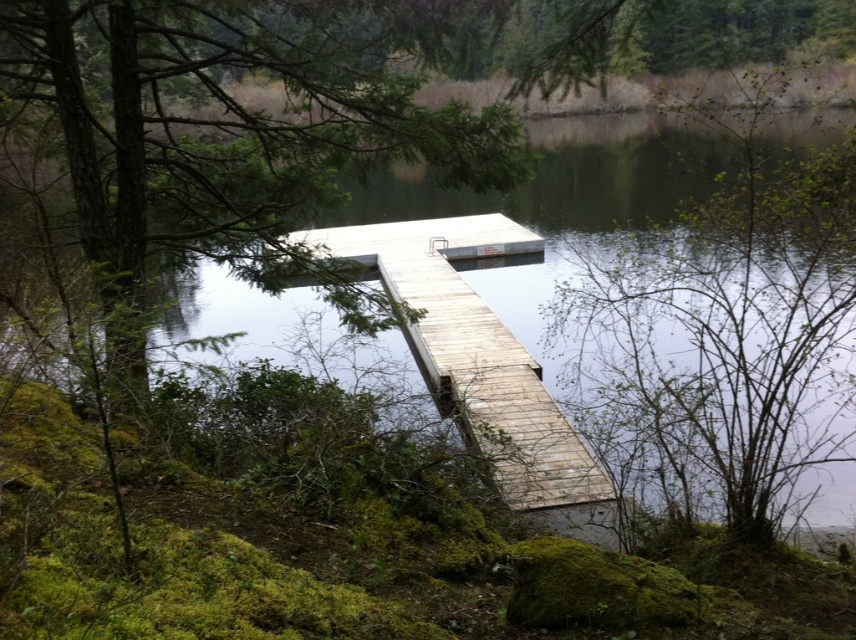
You are standing on the wooden dock at center and looking towards the transparent water at center. Which object is taller from your perspective?

The transparent water at center has a greater height compared to the wooden dock at center, so the transparent water at center appears taller from your perspective.